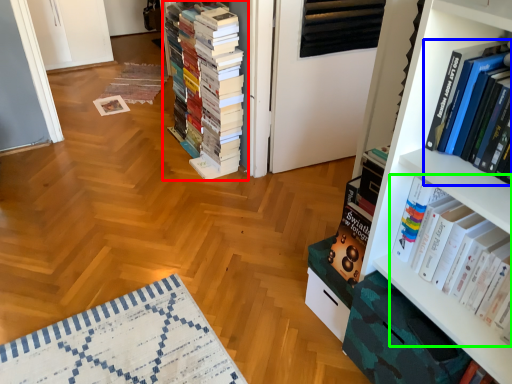
Question: Which object is positioned farthest from book (highlighted by a red box)? Select from book (highlighted by a blue box) and book (highlighted by a green box).

Choices:
 (A) book
 (B) book

Answer: (A)